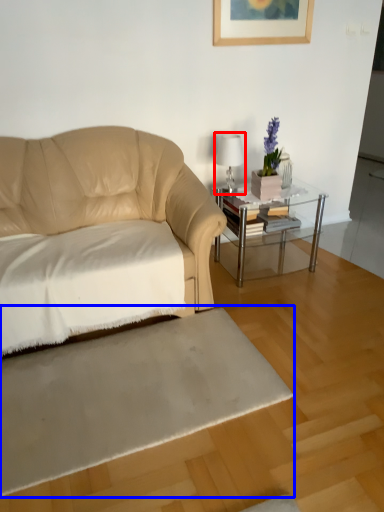
Question: Which object appears closest to the camera in this image, table lamp (highlighted by a red box) or flat (highlighted by a blue box)?

Choices:
 (A) table lamp
 (B) flat

Answer: (B)